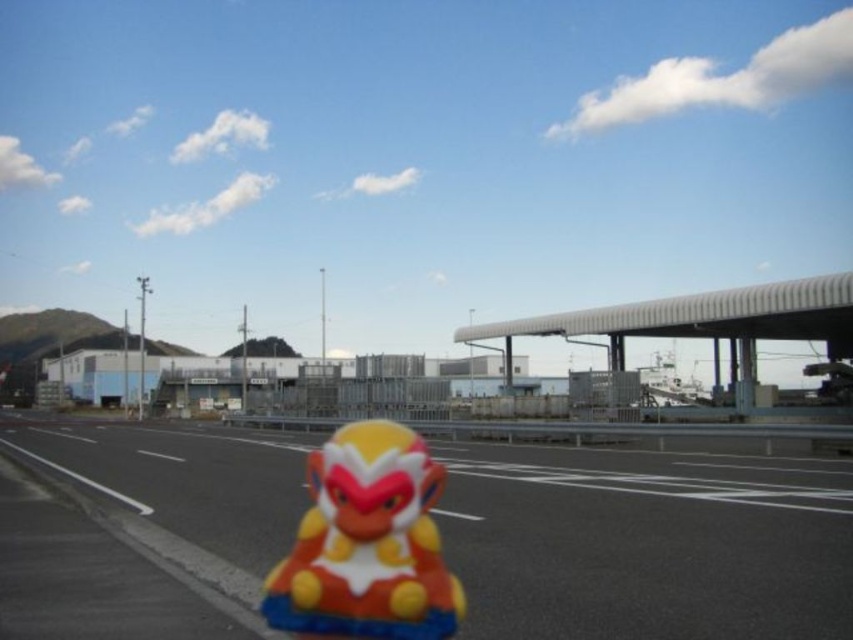
Looking at this image, you are a delivery drone that needs to fly from the glossy plastic monkey at center to the smooth asphalt highway at center. What is the shortest distance you must travel?

The shortest distance you must travel is 16.88 feet to reach the smooth asphalt highway at center from the glossy plastic monkey at center.

In the scene shown: You are a delivery drone flying over the scene. You need to drop a package onto the glossy plastic monkey at center. However, you must avoid hitting the smooth asphalt highway at center. Which object should you aim for and why?

You should aim for the glossy plastic monkey at center because the smooth asphalt highway at center is much taller, so dropping the package there might cause it to hit the highway and miss the monkey.

You are driving a car and see the smooth asphalt highway at center and the glossy plastic monkey at center. Which object is located to the right of the other?

The glossy plastic monkey at center is positioned to the right of the smooth asphalt highway at center.